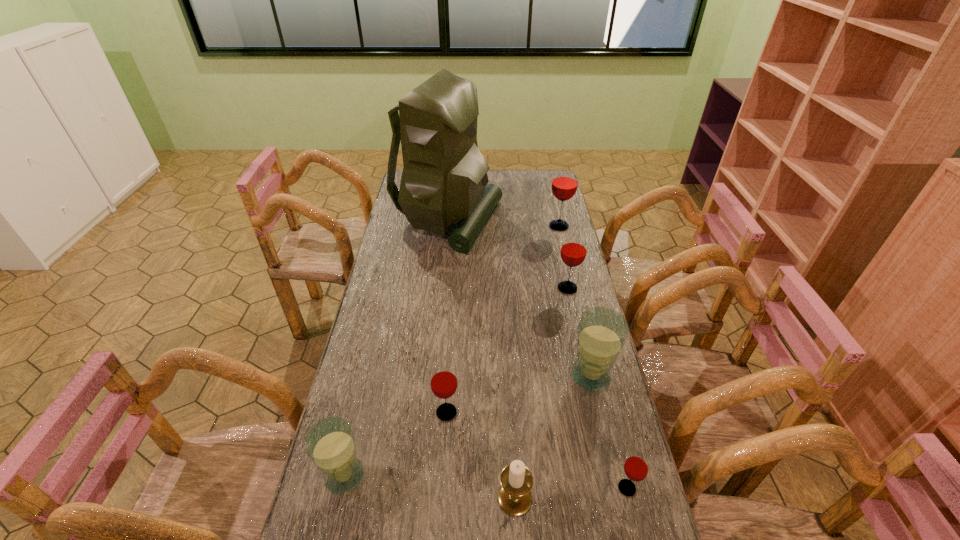
Where is `backpack`? backpack is located at coordinates (444, 180).

Locate an element on the screen. The image size is (960, 540). green backpack is located at coordinates (444, 180).

This screenshot has height=540, width=960. Identify the location of the farthest glass. coord(564,185).

Find the location of a particular element. The height and width of the screenshot is (540, 960). the biggest red glass is located at coordinates (564, 185).

You are a GUI agent. You are given a task and a screenshot of the screen. Output one action in this format:
    pyautogui.click(x=<x>, y=<y>)
    Task: Click on the fifth nearest glass
    The image size is (960, 540).
    Given the screenshot: What is the action you would take?
    pyautogui.click(x=573, y=252)

At what (x,y) coordinates should I click in order to perform the action: click on the third nearest red glass. Please return your answer as a coordinate pair (x, y). The height and width of the screenshot is (540, 960). Looking at the image, I should click on (573, 252).

Image resolution: width=960 pixels, height=540 pixels. I want to click on the right blue glass, so click(x=602, y=332).

You are a GUI agent. You are given a task and a screenshot of the screen. Output one action in this format:
    pyautogui.click(x=<x>, y=<y>)
    Task: Click on the farther blue glass
    This screenshot has width=960, height=540.
    Given the screenshot: What is the action you would take?
    pyautogui.click(x=602, y=332)

Image resolution: width=960 pixels, height=540 pixels. I want to click on the leftmost red glass, so [x=443, y=382].

The height and width of the screenshot is (540, 960). In order to click on the fourth farthest glass in this screenshot , I will do `click(443, 382)`.